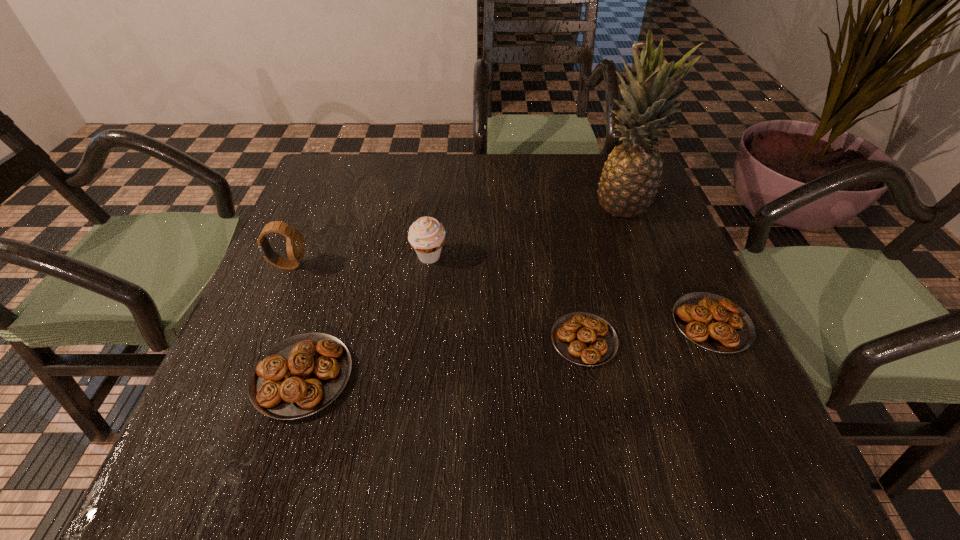
Find the location of a particular element. This screenshot has width=960, height=540. pineapple positioned at the right edge is located at coordinates (629, 182).

This screenshot has width=960, height=540. I want to click on object positioned at the near left corner, so click(299, 376).

This screenshot has height=540, width=960. I want to click on object positioned at the far right corner, so click(x=629, y=182).

Where is `free space at the far edge`? free space at the far edge is located at coordinates (553, 182).

The width and height of the screenshot is (960, 540). Find the location of `vacant space at the near edge of the desktop`. vacant space at the near edge of the desktop is located at coordinates (628, 380).

In the image, there is a desktop. Identify the location of vacant region at the left edge. Image resolution: width=960 pixels, height=540 pixels. [x=304, y=231].

Locate an element on the screen. The width and height of the screenshot is (960, 540). vacant space at the near right corner is located at coordinates click(654, 380).

At what (x,y) coordinates should I click in order to perform the action: click on free space between the leftmost pastry and the farthest object. Please return your answer as a coordinate pair (x, y). Looking at the image, I should click on (463, 291).

Where is `free spot between the fifth tallest object and the leftmost pastry`? The image size is (960, 540). free spot between the fifth tallest object and the leftmost pastry is located at coordinates (507, 350).

Find the location of `free spot between the tallest object and the muffin`. free spot between the tallest object and the muffin is located at coordinates (526, 231).